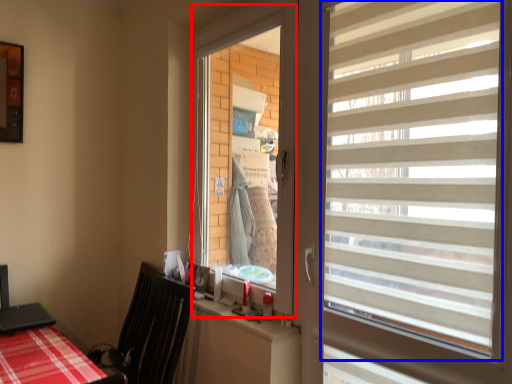
Question: Which object appears closest to the camera in this image, window screen (highlighted by a red box) or window blind (highlighted by a blue box)?

Choices:
 (A) window screen
 (B) window blind

Answer: (B)